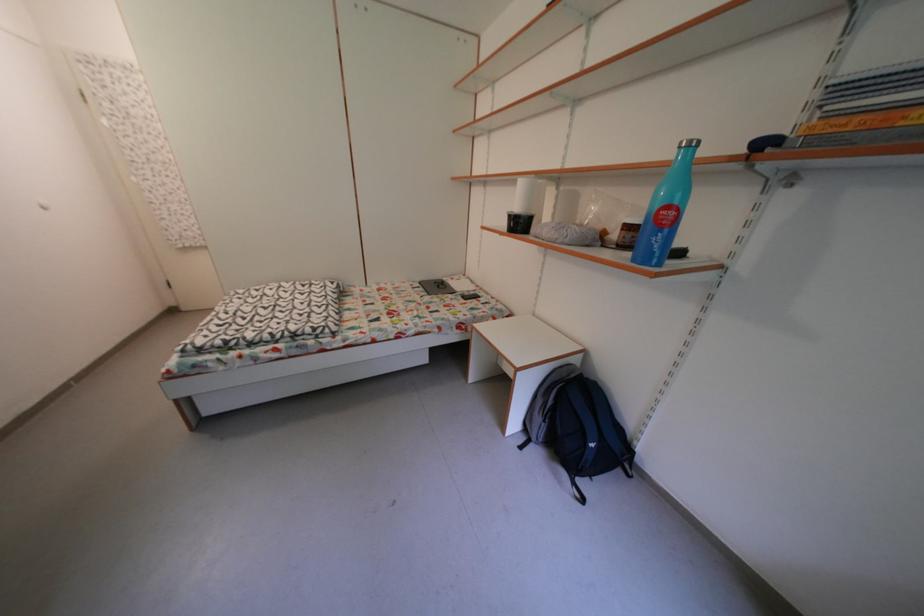
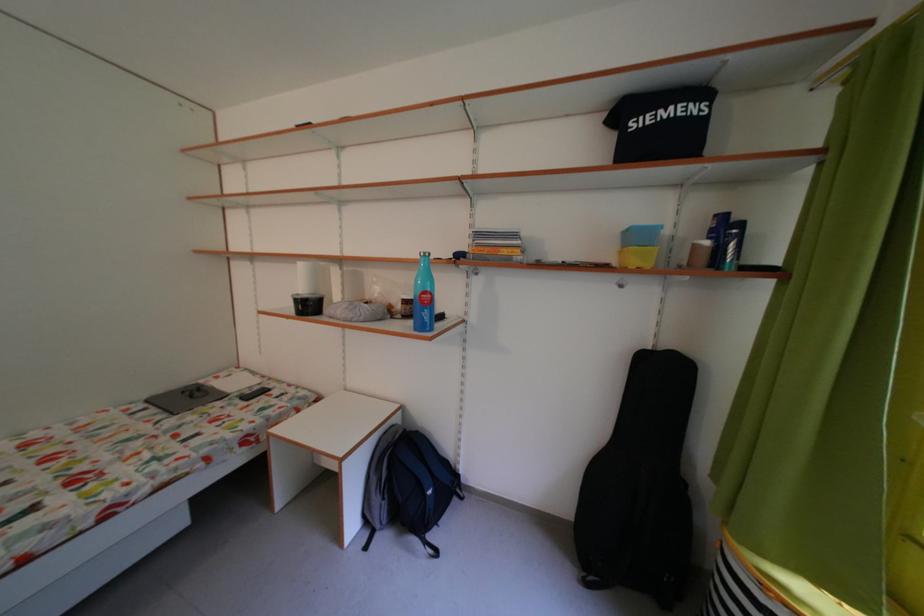
Find the pixel in the second image that matches the point at 519,222 in the first image.

(306, 306)